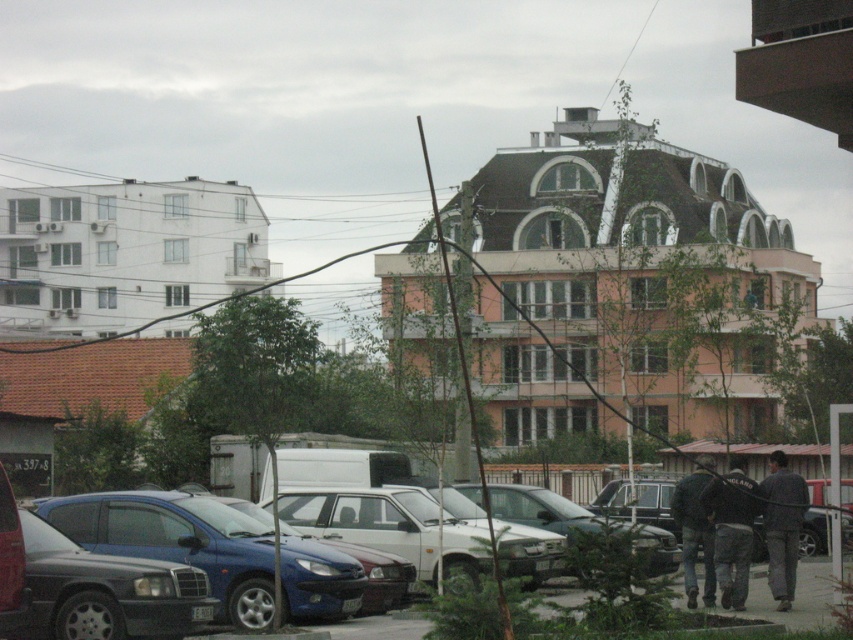
What do you see at coordinates (730, 529) in the screenshot?
I see `dark blue jeans at lower right` at bounding box center [730, 529].

Between point (734, 593) and point (798, 532), which one is positioned in front?

Point (734, 593)

Locate an element on the screen. dark blue jeans at lower right is located at coordinates (730, 529).

Can you confirm if gray cotton pants at lower right is smaller than jeans at lower right?

Correct, gray cotton pants at lower right occupies less space than jeans at lower right.

In the scene shown: Is gray cotton pants at lower right thinner than jeans at lower right?

Yes.

Identify the location of gray cotton pants at lower right. This screenshot has height=640, width=853. (782, 525).

Between dark blue jeans at lower right and jeans at lower right, which one appears on the left side from the viewer's perspective?

From the viewer's perspective, jeans at lower right appears more on the left side.

Does dark blue jeans at lower right have a larger size compared to jeans at lower right?

Yes, dark blue jeans at lower right is bigger than jeans at lower right.

What do you see at coordinates (730, 529) in the screenshot? This screenshot has height=640, width=853. I see `dark blue jeans at lower right` at bounding box center [730, 529].

At what (x,y) coordinates should I click in order to perform the action: click on dark blue jeans at lower right. Please return your answer as a coordinate pair (x, y). Looking at the image, I should click on (730, 529).